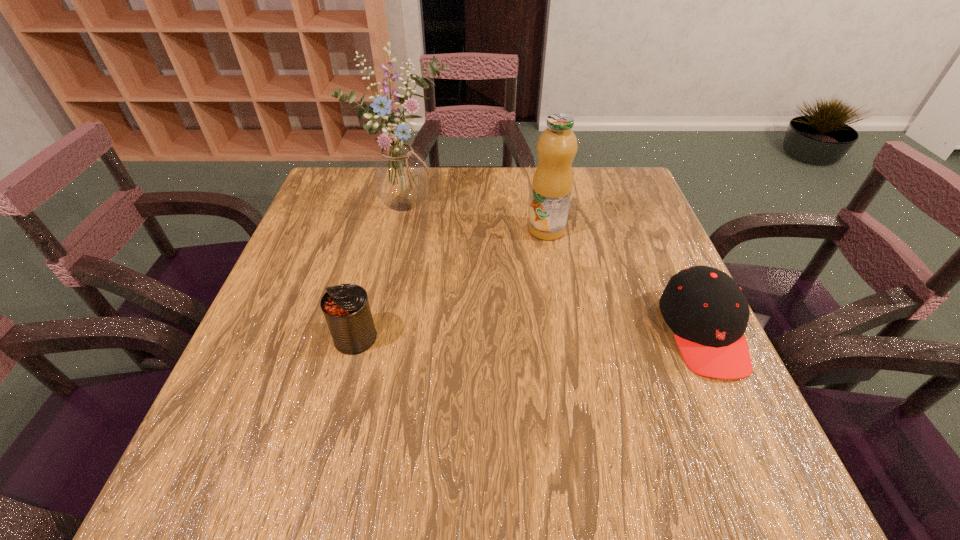
This screenshot has width=960, height=540. I want to click on vacant space on the desktop that is between the can and the cap and is positioned on the front-facing side of the tallest object, so click(524, 335).

Find the location of a particular element. Image resolution: width=960 pixels, height=540 pixels. vacant space on the desktop that is between the can and the shortest object and is positioned on the front label of the second tallest object is located at coordinates (553, 334).